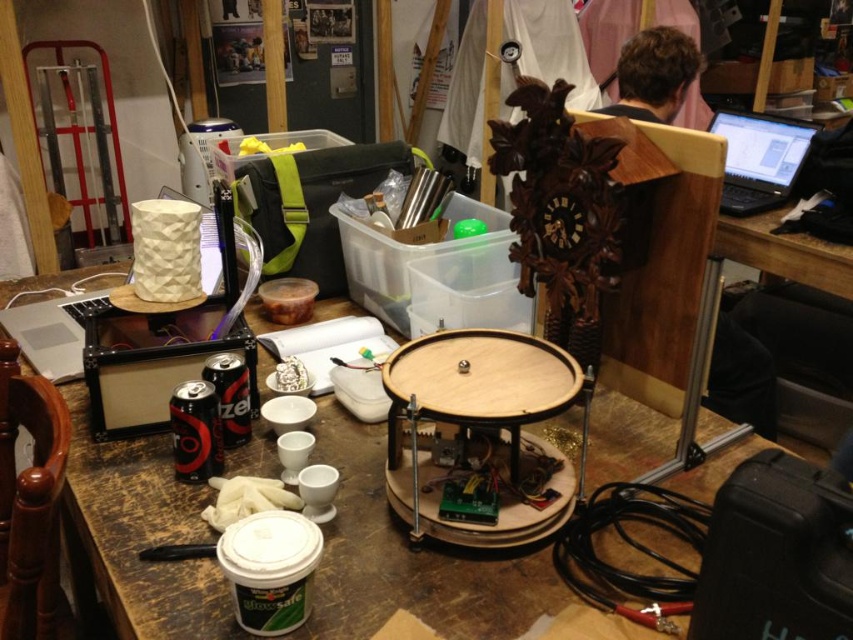
In the scene shown: You are a delivery person who needs to place a new laptop on the table in the workspace. The table is a rectangle with corners at coordinates 0,0 to 1,1. The existing black plastic laptop at upper right is at point 0.248,0.891. Where should you place the new laptop so that it doesn

The new laptop should be placed away from the existing black plastic laptop at upper right to avoid clutter. Since the existing laptop is at (759,157), placing the new one in an open area like near the lower left corner would be ideal.